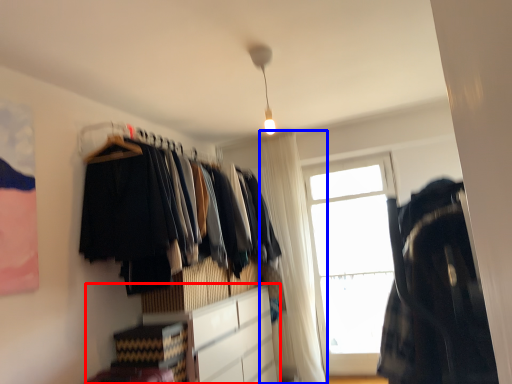
Question: Among these objects, which one is nearest to the camera, cabinetry (highlighted by a red box) or curtain (highlighted by a blue box)?

Choices:
 (A) cabinetry
 (B) curtain

Answer: (A)